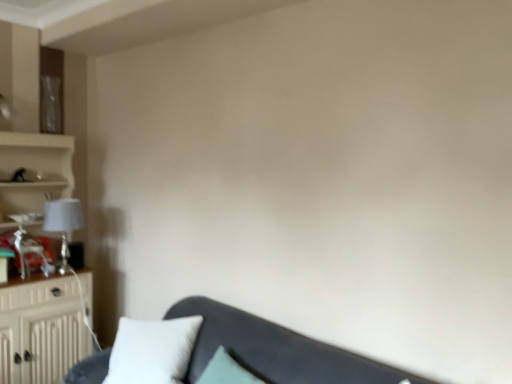
Question: Looking at their shapes, would you say matte white lampshade at left is wider or thinner than velvet dark gray couch at lower center?

Choices:
 (A) thin
 (B) wide

Answer: (A)

Question: From their relative heights in the image, would you say matte white lampshade at left is taller or shorter than velvet dark gray couch at lower center?

Choices:
 (A) tall
 (B) short

Answer: (B)

Question: Considering the real-world distances, which object is closest to the beige wood cabinet at left?

Choices:
 (A) white soft pillow at lower left
 (B) velvet dark gray couch at lower center
 (C) matte white lampshade at left

Answer: (C)

Question: Estimate the real-world distances between objects in this image. Which object is farther from the beige wood cabinet at left?

Choices:
 (A) matte white lampshade at left
 (B) velvet dark gray couch at lower center
 (C) white soft pillow at lower left

Answer: (B)